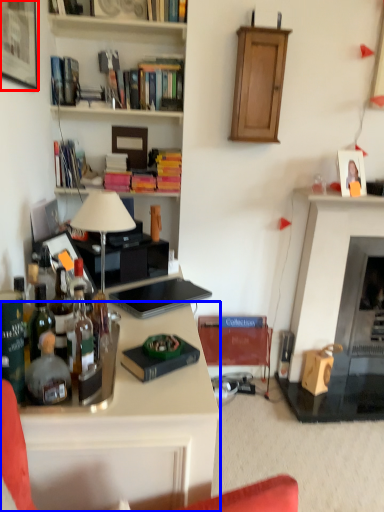
Question: Which object is further to the camera taking this photo, picture frame (highlighted by a red box) or desk (highlighted by a blue box)?

Choices:
 (A) picture frame
 (B) desk

Answer: (A)